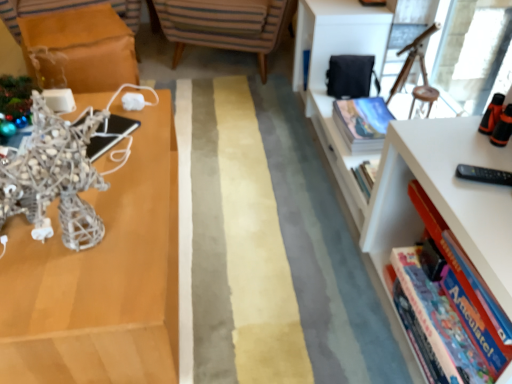
Locate an element on the screen. free space in front of striped fabric chair at center is located at coordinates (232, 114).